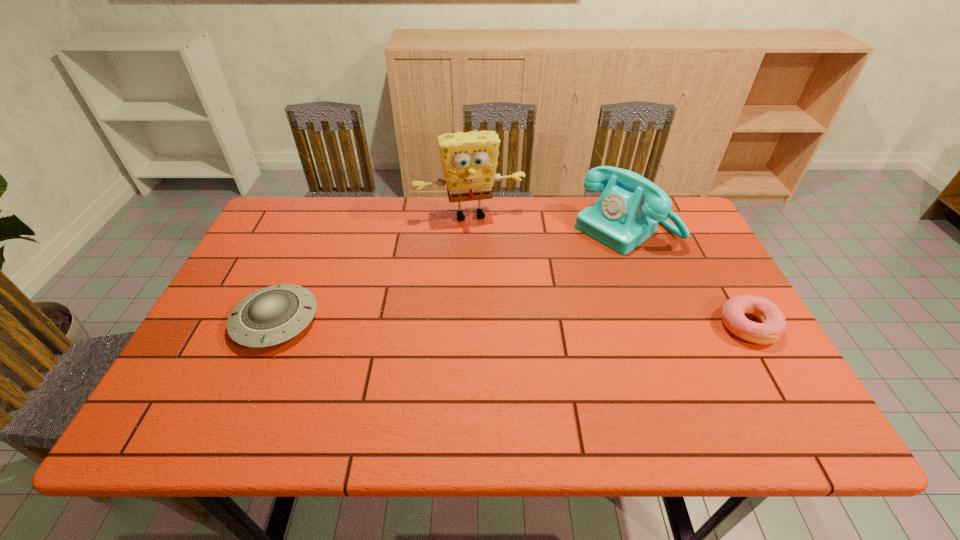
Locate an element on the screen. vacant area that lies between the third shortest object and the doughnut is located at coordinates (686, 277).

Where is `vacant space in between the third object from right to left and the third shortest object`? This screenshot has height=540, width=960. vacant space in between the third object from right to left and the third shortest object is located at coordinates (547, 222).

Where is `empty location between the third shortest object and the leftmost object`? empty location between the third shortest object and the leftmost object is located at coordinates (450, 274).

Find the location of a particular element. free space between the second tallest object and the saucer is located at coordinates (450, 274).

You are a GUI agent. You are given a task and a screenshot of the screen. Output one action in this format:
    pyautogui.click(x=<x>, y=<y>)
    Task: Click on the vacant region between the telephone and the doughnut
    This screenshot has width=960, height=540.
    Given the screenshot: What is the action you would take?
    pyautogui.click(x=686, y=277)

Select which object appears as the third closest to the doughnut. Please provide its 2D coordinates. Your answer should be formatted as a tuple, i.e. [(x, y)], where the tuple contains the x and y coordinates of a point satisfying the conditions above.

[(272, 315)]

At what (x,y) coordinates should I click in order to perform the action: click on object that stands as the closest to the second object from left to right. Please return your answer as a coordinate pair (x, y). Image resolution: width=960 pixels, height=540 pixels. Looking at the image, I should click on (629, 209).

The image size is (960, 540). Identify the location of vacant region that satisfies the following two spatial constraints: 1. on the front side of the telephone; 2. on the left side of the tallest object. (469, 228).

At what (x,y) coordinates should I click in order to perform the action: click on vacant space that satisfies the following two spatial constraints: 1. on the front side of the telephone; 2. on the left side of the second object from left to right. Please return your answer as a coordinate pair (x, y). Looking at the image, I should click on click(469, 228).